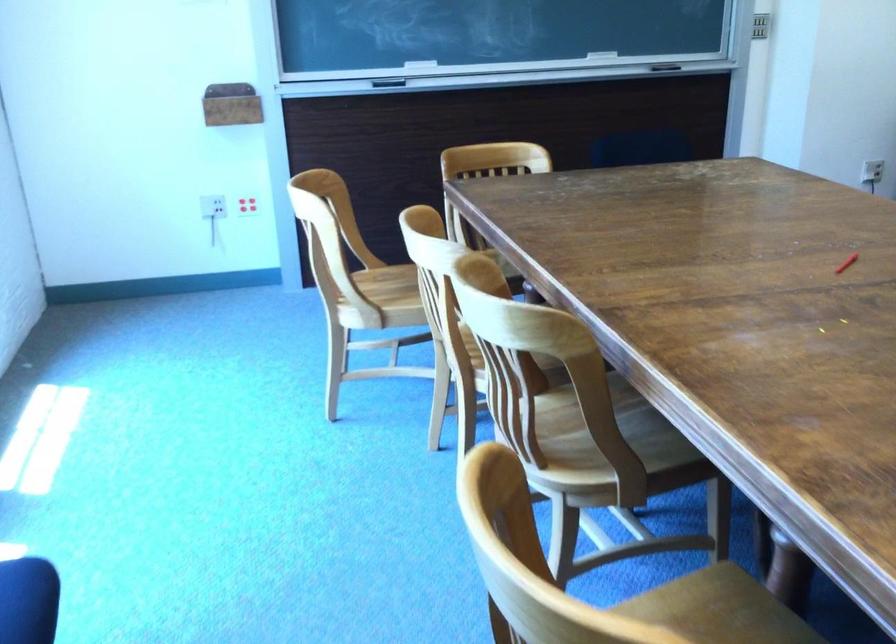
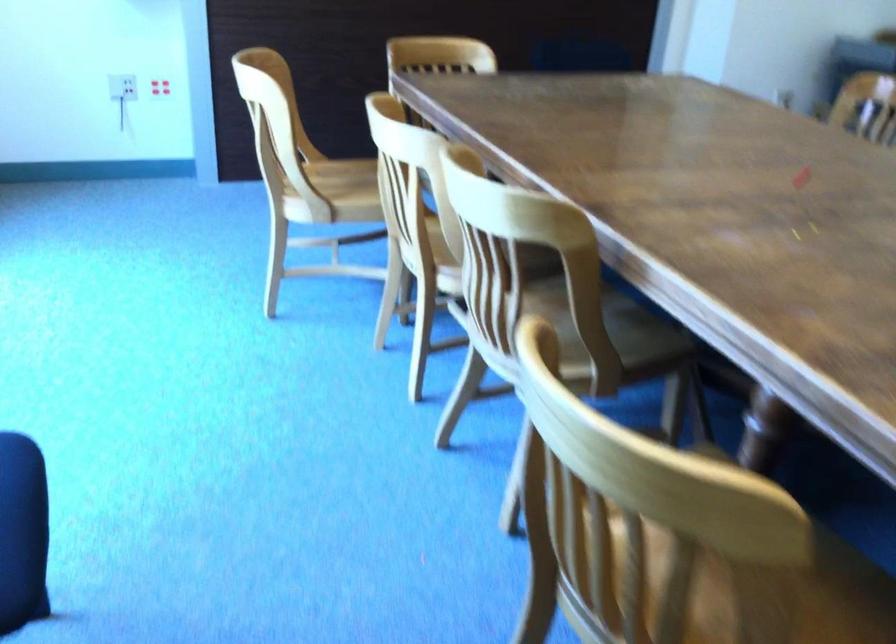
Locate, in the second image, the point that corresponds to the point at 409,285 in the first image.

(347, 180)